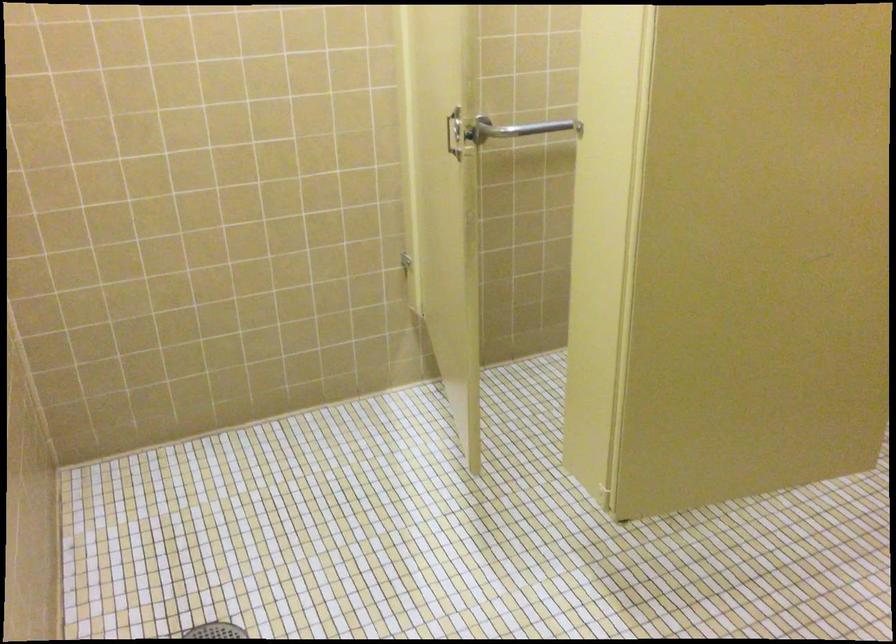
Consider the image. The first image is from the beginning of the video and the second image is from the end. How did the camera likely rotate when shooting the video?

The camera rotated toward left-down.